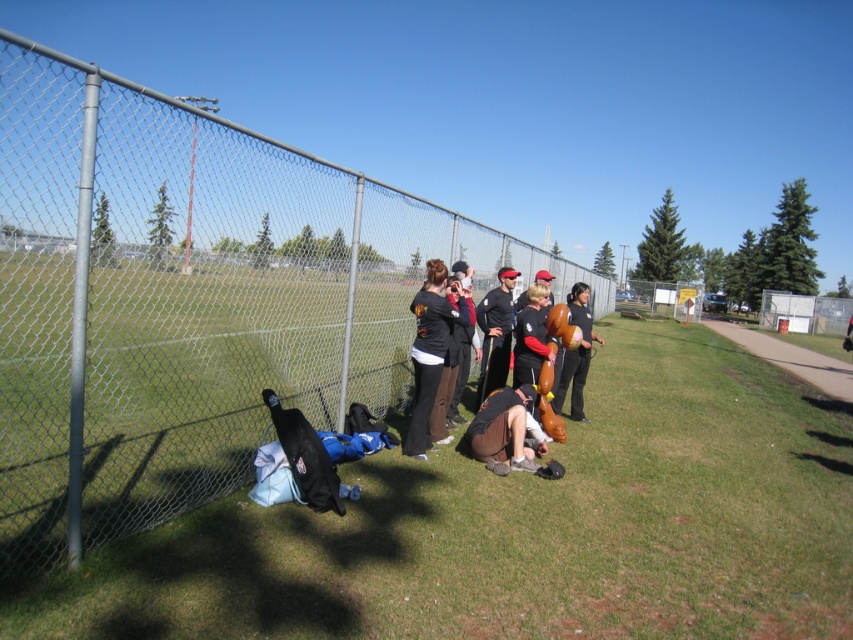
You are a photographer trying to capture a photo of the brown cotton pants at lower center and the matte black balloon at right. If the pants are wider than the balloon, will they block the balloon from view in the photo?

The brown cotton pants at lower center might be wider than matte black balloon at right, so there is a possibility that the pants could block the balloon from view in the photo if they are positioned between the camera and the balloon.